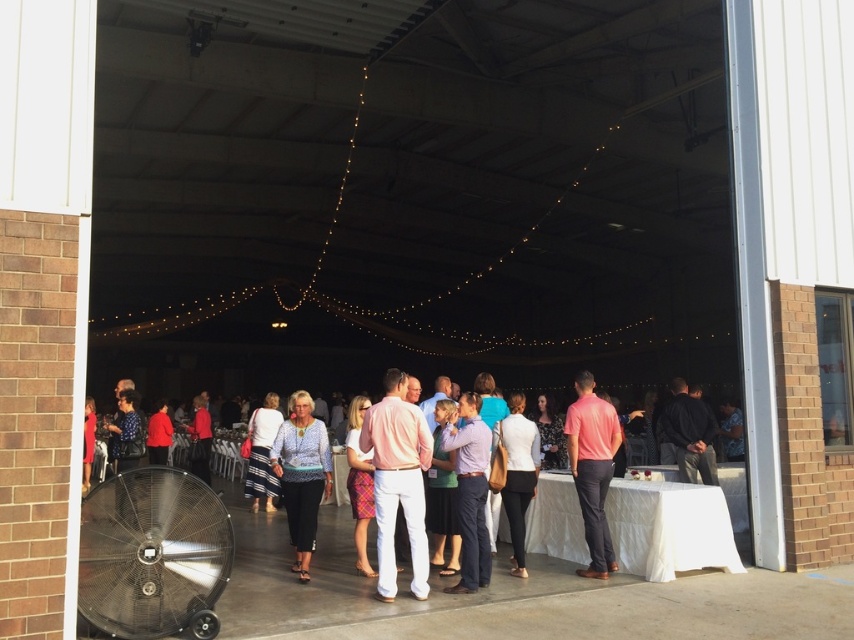
Consider the image. You are organizing a photo shoot and need to position a camera 7 meters away from the patterned fabric blouse at center. Based on the scene described, is this possible within the space?

The objects are 6.69 meters apart, so placing the camera 7 meters away from the patterned fabric blouse at center would not be possible within the space as the maximum distance available is less than required.

You are a photographer at the event and need to ensure both the patterned fabric blouse at center and the white matte blazer at center fit within the camera frame. Since the camera has a fixed width, which clothing item requires more horizontal space?

The patterned fabric blouse at center requires more horizontal space because its width surpasses that of the white matte blazer at center.